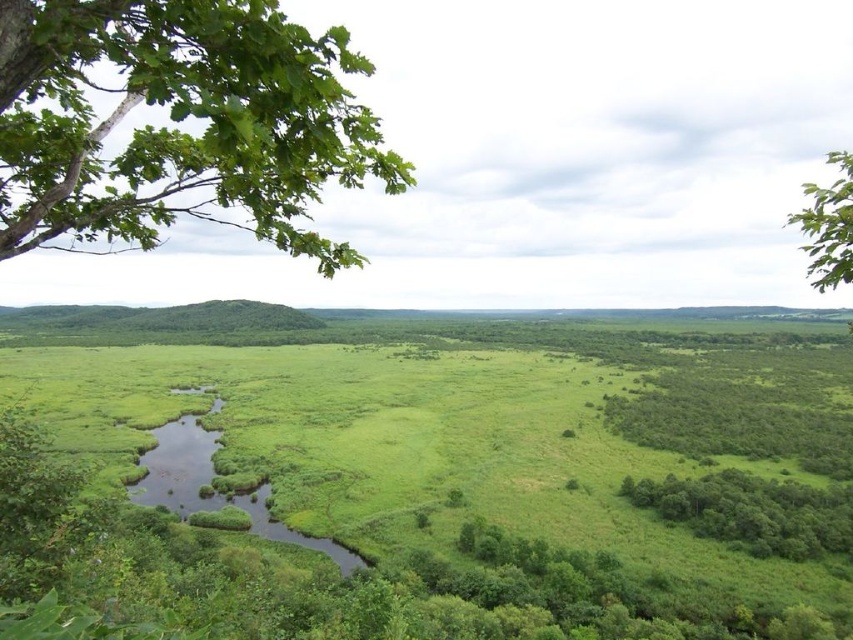
Looking at this image, does green grassy field at center come in front of green leafy branch at upper left?

That is False.

Does green grassy field at center have a lesser height compared to green leafy branch at upper left?

Yes, green grassy field at center is shorter than green leafy branch at upper left.

Describe the element at coordinates (462, 470) in the screenshot. I see `green grassy field at center` at that location.

Find the location of a particular element. green grassy field at center is located at coordinates (462, 470).

Between green leafy branch at upper left and green leafy trees at lower right, which one is positioned lower?

green leafy trees at lower right

The image size is (853, 640). Describe the element at coordinates (178, 122) in the screenshot. I see `green leafy branch at upper left` at that location.

This screenshot has width=853, height=640. What are the coordinates of `green leafy branch at upper left` in the screenshot? It's located at (178, 122).

Which is more to the right, green grassy field at center or green leafy tree at upper right?

From the viewer's perspective, green leafy tree at upper right appears more on the right side.

Is green grassy field at center wider than green leafy tree at upper right?

Correct, the width of green grassy field at center exceeds that of green leafy tree at upper right.

In order to click on green grassy field at center in this screenshot , I will do `click(462, 470)`.

This screenshot has height=640, width=853. Identify the location of green grassy field at center. (462, 470).